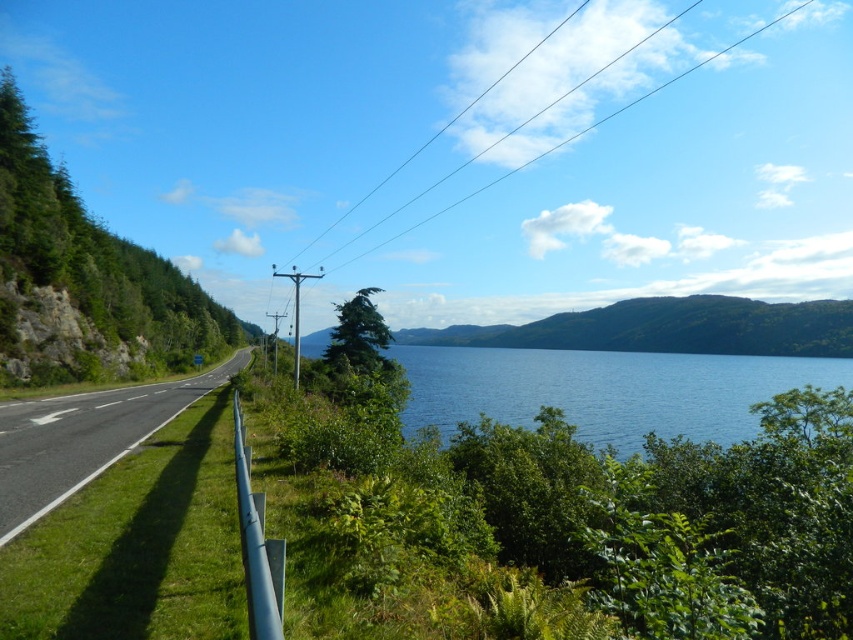
You are a driver approaching a scenic road. You see the blue water at center and the black asphalt highway at left. Which object is positioned lower in the image?

The blue water at center is located below the black asphalt highway at left, so it is positioned lower in the image.

You are a driver approaching the black asphalt highway at left and the black wire at upper center. Which object appears smaller in the scene?

The black asphalt highway at left appears smaller than the black wire at upper center in the scene.

You are standing at the starting point of the road and want to reach the blue water at center. Which direction should you walk to get there?

You should walk towards the center of the image to reach the blue water at center.